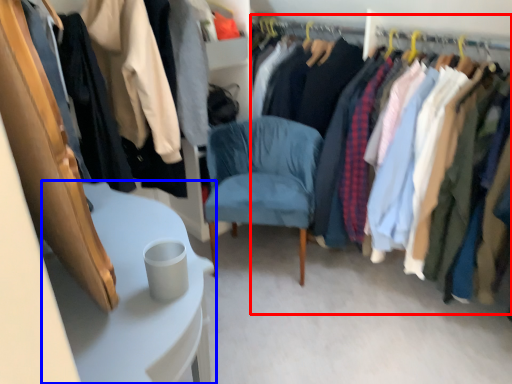
Question: Which point is closer to the camera, closet (highlighted by a red box) or table (highlighted by a blue box)?

Choices:
 (A) closet
 (B) table

Answer: (B)